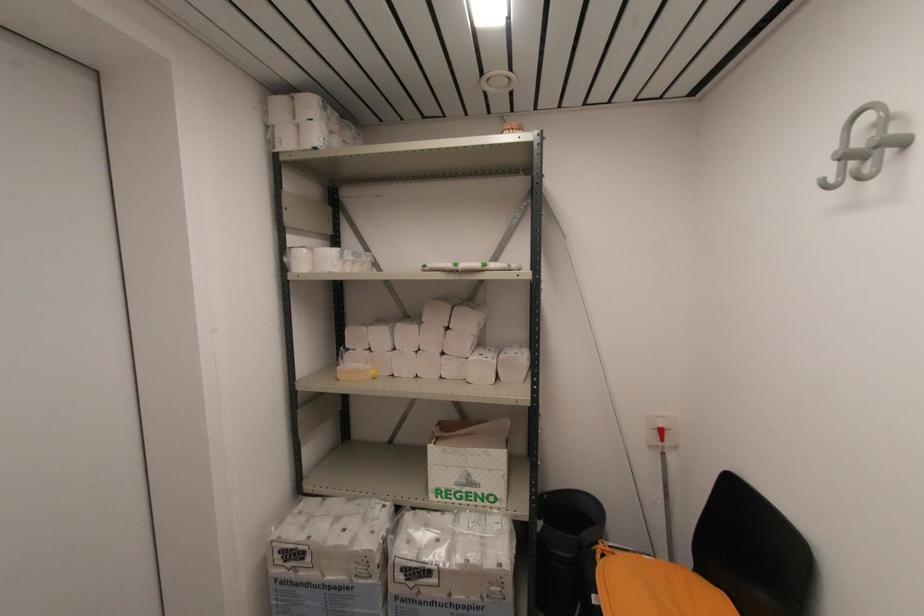
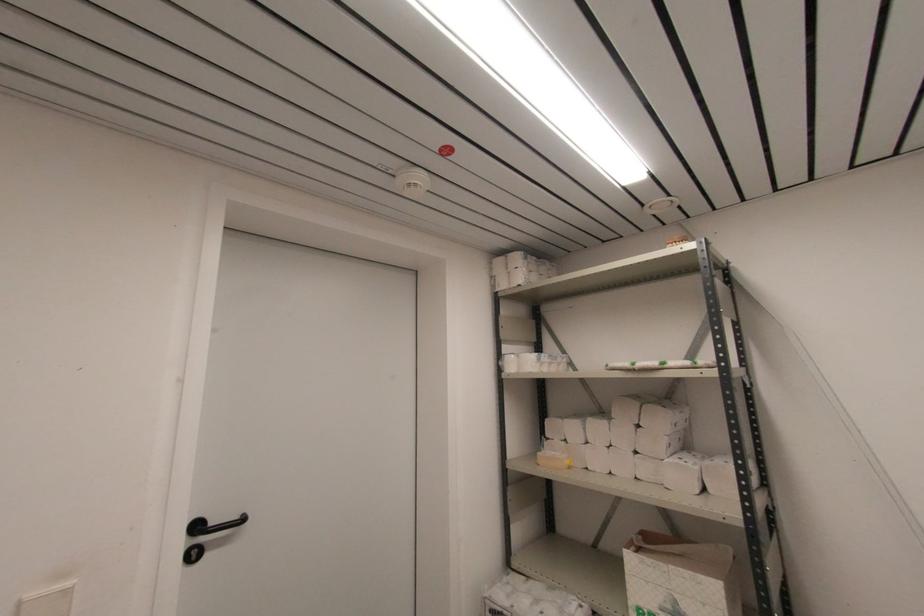
Locate, in the second image, the point that corresponds to point (339, 381) in the first image.

(540, 464)